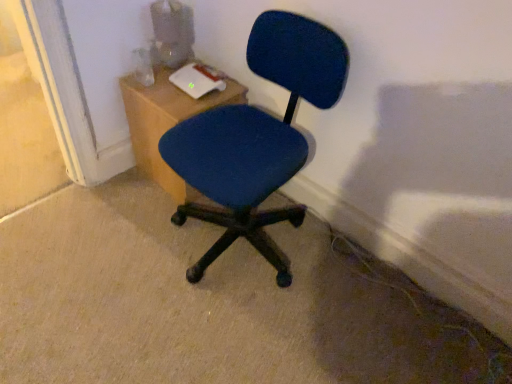
What is the approximate height of wooden table at upper left?

It is 19.48 inches.

The image size is (512, 384). Describe the element at coordinates (166, 121) in the screenshot. I see `wooden table at upper left` at that location.

I want to click on wooden table at upper left, so click(x=166, y=121).

Measure the distance between wooden table at upper left and camera.

The distance of wooden table at upper left from camera is 1.58 meters.

Find the location of a particular element. blue fabric chair at center is located at coordinates (257, 138).

What is the approximate height of blue fabric chair at center?

33.82 inches.

The width and height of the screenshot is (512, 384). Describe the element at coordinates (257, 138) in the screenshot. I see `blue fabric chair at center` at that location.

This screenshot has width=512, height=384. I want to click on wooden table at upper left, so click(x=166, y=121).

Looking at this image, is wooden table at upper left at the right side of blue fabric chair at center?

No.

Relative to blue fabric chair at center, is wooden table at upper left in front or behind?

In the image, wooden table at upper left appears behind blue fabric chair at center.

Is point (164, 81) positioned behind point (266, 121)?

Yes, point (164, 81) is farther from viewer.

From the image's perspective, which is below, wooden table at upper left or blue fabric chair at center?

blue fabric chair at center appears lower in the image.

From a real-world perspective, is wooden table at upper left positioned over blue fabric chair at center based on gravity?

Actually, wooden table at upper left is physically below blue fabric chair at center in the real world.

Between wooden table at upper left and blue fabric chair at center, which one has smaller width?

Thinner between the two is wooden table at upper left.

From their relative heights in the image, would you say wooden table at upper left is taller or shorter than blue fabric chair at center?

Clearly, wooden table at upper left is shorter compared to blue fabric chair at center.

Considering the sizes of objects wooden table at upper left and blue fabric chair at center in the image provided, who is bigger, wooden table at upper left or blue fabric chair at center?

blue fabric chair at center is bigger.

Can we say wooden table at upper left lies outside blue fabric chair at center?

Yes, wooden table at upper left is located beyond the bounds of blue fabric chair at center.

Is wooden table at upper left placed right next to blue fabric chair at center?

No, wooden table at upper left is not next to blue fabric chair at center.

Is wooden table at upper left positioned with its back to blue fabric chair at center?

That's not correct — wooden table at upper left is not looking away from blue fabric chair at center.

Can you tell me how much wooden table at upper left and blue fabric chair at center differ in facing direction?

87 degrees.

In the scene shown: Measure the distance from wooden table at upper left to blue fabric chair at center.

13.69 inches.

The width and height of the screenshot is (512, 384). Identify the location of table located underneath the blue fabric chair at center (from a real-world perspective). (166, 121).

Consider the image. Visually, is blue fabric chair at center positioned to the left or to the right of wooden table at upper left?

From the image, it's evident that blue fabric chair at center is to the right of wooden table at upper left.

Considering their positions, is blue fabric chair at center located in front of or behind wooden table at upper left?

In the image, blue fabric chair at center appears in front of wooden table at upper left.

Is point (282, 122) closer to camera compared to point (165, 174)?

Yes.

From the image's perspective, which one is positioned higher, blue fabric chair at center or wooden table at upper left?

wooden table at upper left is shown above in the image.

From a real-world perspective, is blue fabric chair at center located higher than wooden table at upper left?

Yes, from a real-world perspective, blue fabric chair at center is above wooden table at upper left.

Looking at their sizes, would you say blue fabric chair at center is wider or thinner than wooden table at upper left?

Considering their sizes, blue fabric chair at center looks broader than wooden table at upper left.

Between blue fabric chair at center and wooden table at upper left, which one has less height?

wooden table at upper left.

Does blue fabric chair at center have a smaller size compared to wooden table at upper left?

No, blue fabric chair at center is not smaller than wooden table at upper left.

Is blue fabric chair at center inside the boundaries of wooden table at upper left, or outside?

blue fabric chair at center exists outside the volume of wooden table at upper left.

Are blue fabric chair at center and wooden table at upper left far apart?

No, blue fabric chair at center is not far away from wooden table at upper left.

Does blue fabric chair at center turn towards wooden table at upper left?

No, blue fabric chair at center does not turn towards wooden table at upper left.

How many degrees apart are the facing directions of blue fabric chair at center and wooden table at upper left?

The angular difference between blue fabric chair at center and wooden table at upper left is 87 degrees.

Where is `table that is under the blue fabric chair at center (from a real-world perspective)`? This screenshot has width=512, height=384. table that is under the blue fabric chair at center (from a real-world perspective) is located at coordinates (166, 121).

This screenshot has height=384, width=512. I want to click on chair located above the wooden table at upper left (from a real-world perspective), so click(257, 138).

The height and width of the screenshot is (384, 512). What are the coordinates of `table behind the blue fabric chair at center` in the screenshot? It's located at (166, 121).